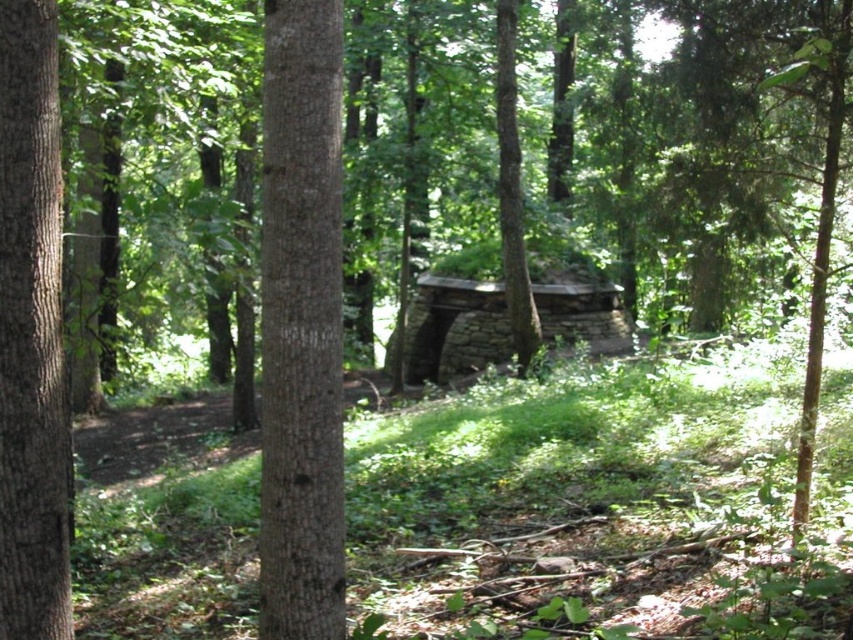
Does point (299, 209) lie behind point (463, 316)?

No.

Between smooth brown tree trunk at center and rustic stone log cabin at center, which one is positioned higher?

smooth brown tree trunk at center is above.

Find the location of `smooth brown tree trunk at center`. smooth brown tree trunk at center is located at coordinates (300, 324).

Find the location of a particular element. The width and height of the screenshot is (853, 640). smooth brown tree trunk at center is located at coordinates (300, 324).

Measure the distance between point (56,400) and camera.

Point (56,400) and camera are 4.76 meters apart from each other.

Is brown rough bark tree at left smaller than rustic stone log cabin at center?

Yes, brown rough bark tree at left is smaller than rustic stone log cabin at center.

Is point (45, 70) closer to camera compared to point (602, 314)?

That is True.

At what (x,y) coordinates should I click in order to perform the action: click on brown rough bark tree at left. Please return your answer as a coordinate pair (x, y). The image size is (853, 640). Looking at the image, I should click on (32, 332).

Who is more distant from viewer, (270, 148) or (509, 134)?

The point (509, 134) is behind.

Which is above, smooth brown tree trunk at center or brown rough bark tree at center?

Positioned higher is brown rough bark tree at center.

This screenshot has height=640, width=853. What are the coordinates of `smooth brown tree trunk at center` in the screenshot? It's located at pyautogui.click(x=300, y=324).